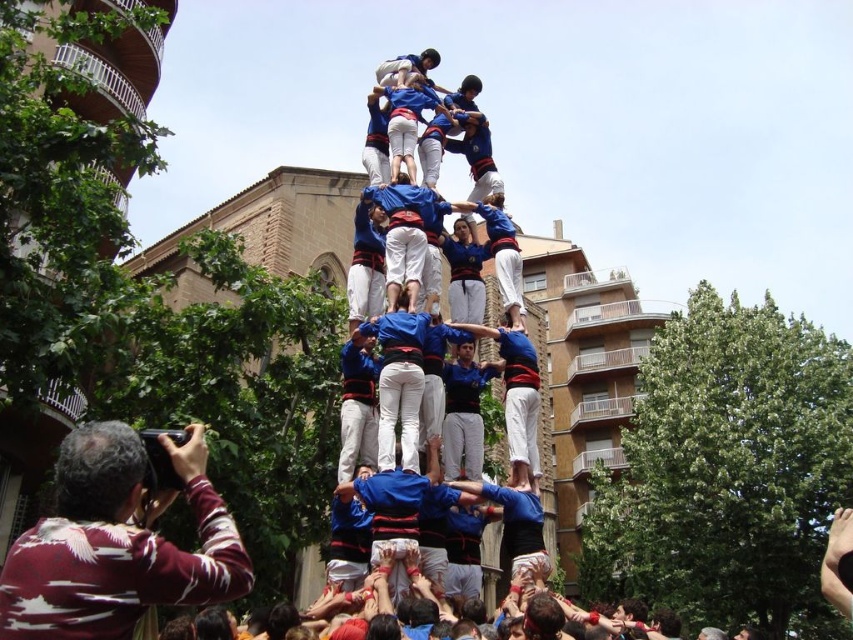
Question: Is maroon striped shirt at lower left bigger than blue jersey at center?

Choices:
 (A) yes
 (B) no

Answer: (B)

Question: Does maroon striped shirt at lower left appear under blue jersey at center?

Choices:
 (A) yes
 (B) no

Answer: (A)

Question: Which of the following is the closest to the observer?

Choices:
 (A) (474, 148)
 (B) (241, 580)

Answer: (B)

Question: Which point appears farthest from the camera in this image?

Choices:
 (A) (20, 612)
 (B) (419, 83)

Answer: (B)

Question: Is maroon striped shirt at lower left thinner than blue jersey at center?

Choices:
 (A) no
 (B) yes

Answer: (B)